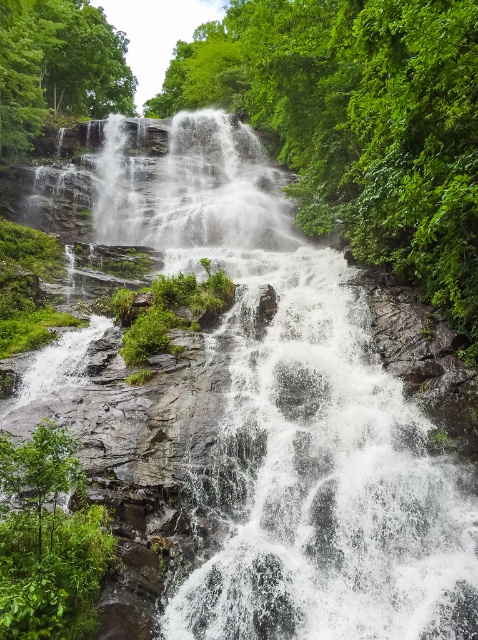
Question: Is white frothy water at center to the left of green leafy tree at upper left from the viewer's perspective?

Choices:
 (A) no
 (B) yes

Answer: (A)

Question: Which point is farther from the camera taking this photo?

Choices:
 (A) (63, 22)
 (B) (238, 145)

Answer: (A)

Question: Can you confirm if white frothy water at center is wider than green leafy tree at upper left?

Choices:
 (A) yes
 (B) no

Answer: (A)

Question: Which point appears closest to the camera in this image?

Choices:
 (A) (206, 198)
 (B) (41, 109)

Answer: (A)

Question: Which point is farther from the camera taking this photo?

Choices:
 (A) (104, 28)
 (B) (107, 157)

Answer: (A)

Question: Does white frothy water at center appear under green leafy tree at upper left?

Choices:
 (A) no
 (B) yes

Answer: (B)